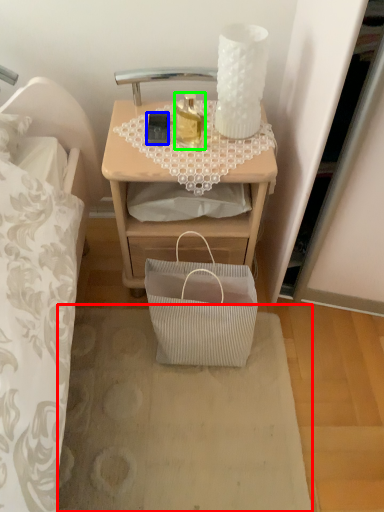
Question: Based on their relative distances, which object is farther from plain (highlighted by a red box)? Choose from mobile phone (highlighted by a blue box) and bottle (highlighted by a green box).

Choices:
 (A) mobile phone
 (B) bottle

Answer: (A)